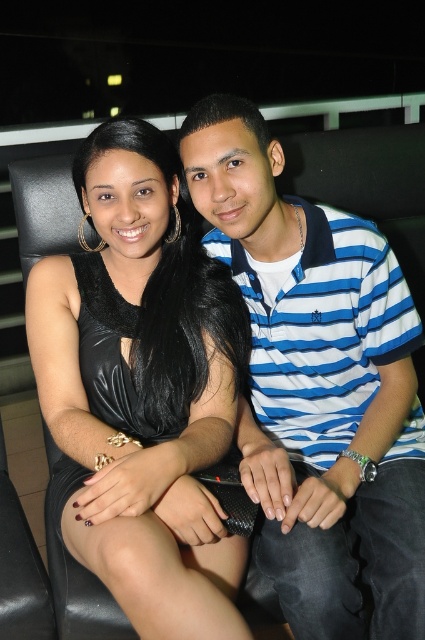
You are planning to sit between the blue striped polo shirt at center and the black leather dress at center. Which clothing item has a greater width that might require more space on the seat?

The blue striped polo shirt at center has a greater width than the black leather dress at center, so it would require more space on the seat.

You are a photographer setting up for a group photo. You notice the blue striped polo shirt at center and the black leather dress at center. Which clothing item is taller in the image?

The blue striped polo shirt at center has a greater height compared to the black leather dress at center, so the blue striped polo shirt at center is taller.